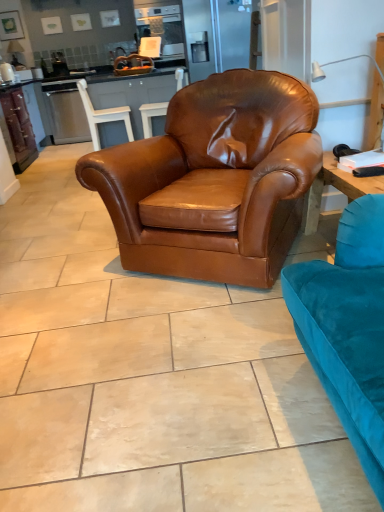
Question: Can we say satin silver oven at upper center lies outside brown leather armchair at center, which ranks as the 1th chair in front-to-back order?

Choices:
 (A) no
 (B) yes

Answer: (B)

Question: Is brown leather armchair at center, which is counted as the third chair, starting from the back, inside satin silver oven at upper center?

Choices:
 (A) no
 (B) yes

Answer: (A)

Question: Is satin silver oven at upper center facing away from brown leather armchair at center, which is counted as the third chair, starting from the back?

Choices:
 (A) no
 (B) yes

Answer: (A)

Question: Can you confirm if satin silver oven at upper center is positioned to the left of brown leather armchair at center, which is counted as the third chair, starting from the back?

Choices:
 (A) no
 (B) yes

Answer: (B)

Question: Is satin silver oven at upper center far away from brown leather armchair at center, which ranks as the 1th chair in front-to-back order?

Choices:
 (A) yes
 (B) no

Answer: (A)

Question: Would you say satin silver oven at upper center is to the left or to the right of brown leather armchair at center, which ranks as the 1th chair in front-to-back order, in the picture?

Choices:
 (A) left
 (B) right

Answer: (A)

Question: Is satin silver oven at upper center situated inside brown leather armchair at center, which ranks as the 1th chair in front-to-back order, or outside?

Choices:
 (A) inside
 (B) outside

Answer: (B)

Question: In terms of height, does satin silver oven at upper center look taller or shorter compared to brown leather armchair at center, which ranks as the 1th chair in front-to-back order?

Choices:
 (A) tall
 (B) short

Answer: (B)

Question: Looking at the image, does satin silver oven at upper center seem bigger or smaller compared to brown leather armchair at center, which ranks as the 1th chair in front-to-back order?

Choices:
 (A) big
 (B) small

Answer: (B)

Question: Does point (269, 151) appear closer or farther from the camera than point (163, 114)?

Choices:
 (A) closer
 (B) farther

Answer: (A)

Question: Considering the positions of brown leather armchair at center, which is counted as the third chair, starting from the back, and brown leather armchair at center, which is counted as the 1th chair, starting from the back, in the image, is brown leather armchair at center, which is counted as the third chair, starting from the back, bigger or smaller than brown leather armchair at center, which is counted as the 1th chair, starting from the back,?

Choices:
 (A) big
 (B) small

Answer: (A)

Question: From the image's perspective, is brown leather armchair at center, which is counted as the third chair, starting from the back, above or below brown leather armchair at center, which is counted as the 1th chair, starting from the back?

Choices:
 (A) below
 (B) above

Answer: (A)

Question: From their relative heights in the image, would you say brown leather armchair at center, which is counted as the third chair, starting from the back, is taller or shorter than brown leather armchair at center, which is counted as the 3th chair, starting from the front?

Choices:
 (A) short
 (B) tall

Answer: (B)

Question: Based on their sizes in the image, would you say brown leather armchair at center, which is counted as the 1th chair, starting from the back, is bigger or smaller than brown leather armchair at center, the 2th chair viewed from the front?

Choices:
 (A) small
 (B) big

Answer: (A)

Question: Is point (145, 122) positioned closer to the camera than point (89, 128)?

Choices:
 (A) closer
 (B) farther

Answer: (A)